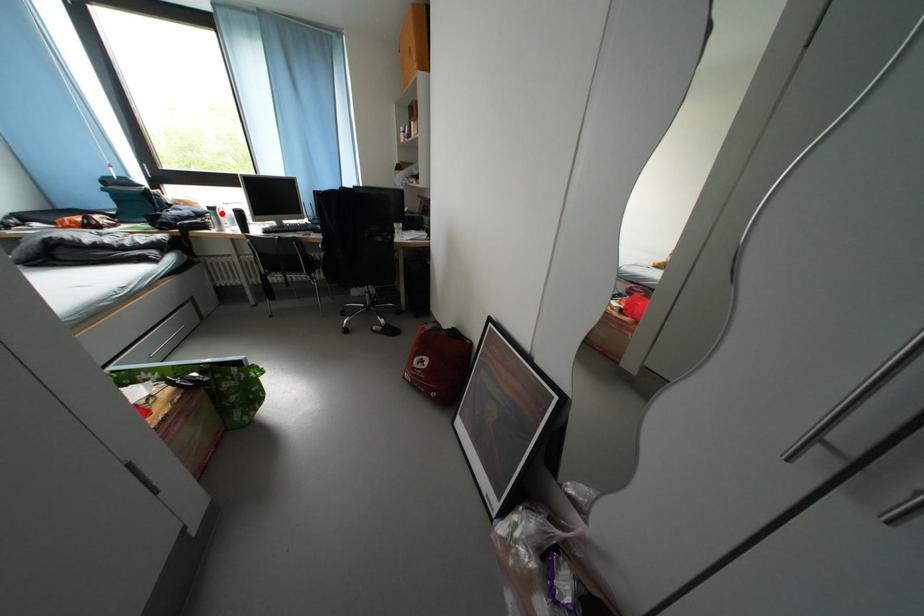
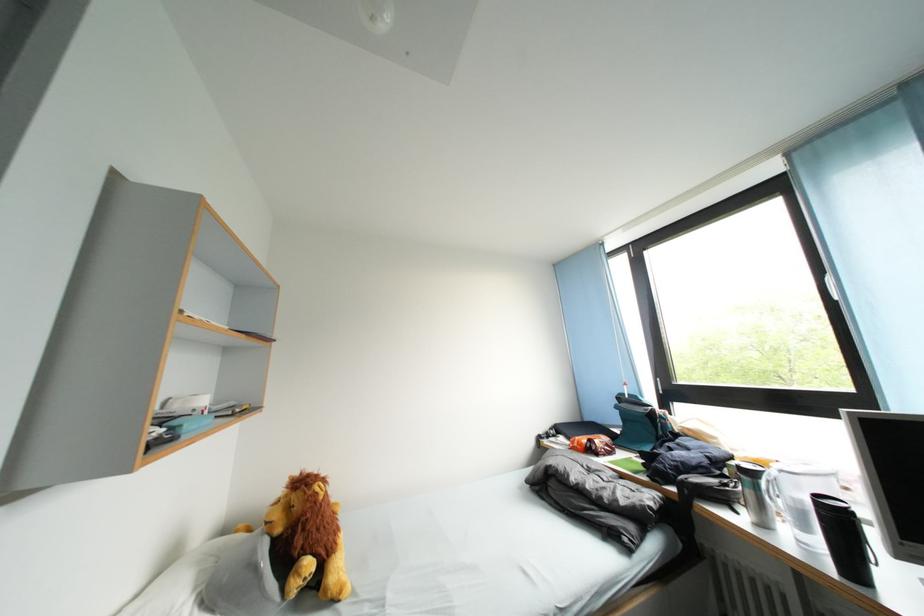
In the second image, find the point that corresponds to the highlighted location in the first image.

(759, 479)